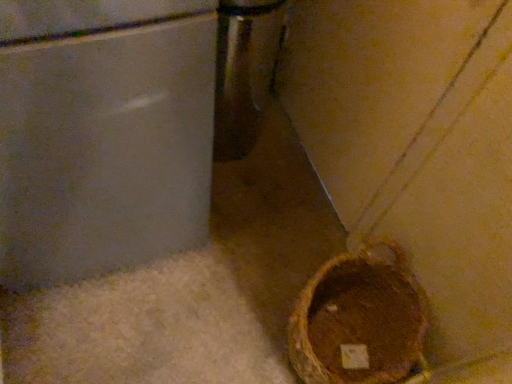
Describe the element at coordinates (360, 321) in the screenshot. I see `rustic woven basket at lower right` at that location.

In order to face rustic woven basket at lower right, should I rotate leftwards or rightwards?

To align with it, rotate right about 12.483°.

What is the approximate width of rustic woven basket at lower right?

rustic woven basket at lower right is 14.51 inches wide.

This screenshot has width=512, height=384. I want to click on rustic woven basket at lower right, so click(360, 321).

Locate an element on the screen. The image size is (512, 384). rustic woven basket at lower right is located at coordinates (360, 321).